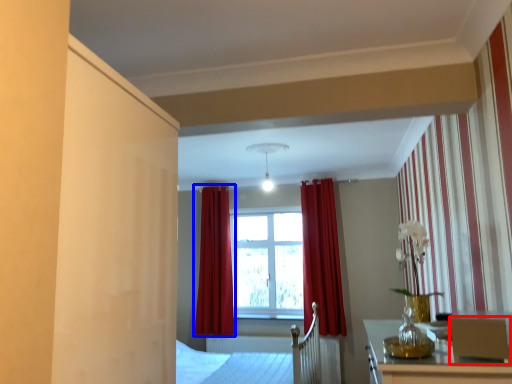
Question: Which object is further to the camera taking this photo, armchair (highlighted by a red box) or curtain (highlighted by a blue box)?

Choices:
 (A) armchair
 (B) curtain

Answer: (B)